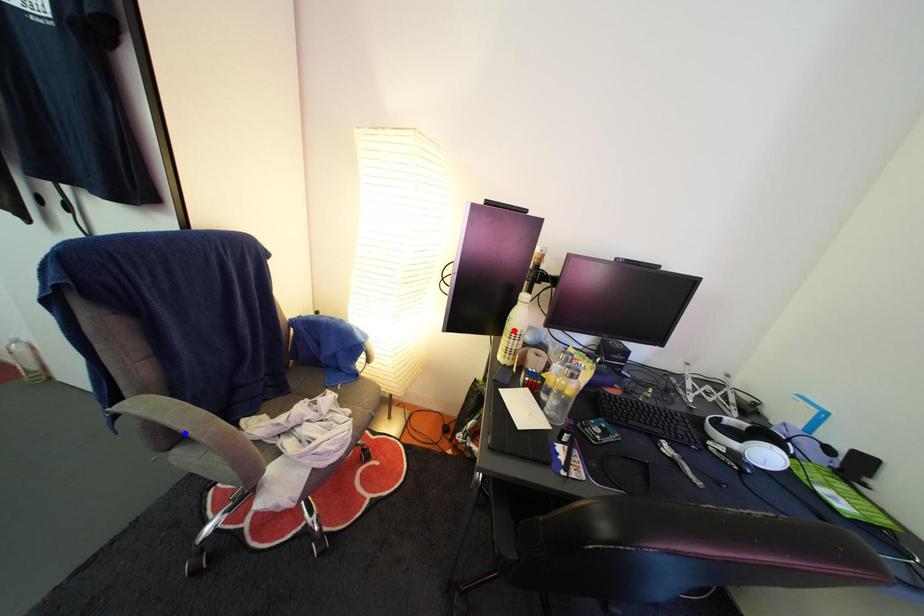
Question: Two points are marked on the image. Which point is closer to the camera?

Choices:
 (A) Blue point is closer.
 (B) Red point is closer.

Answer: (A)